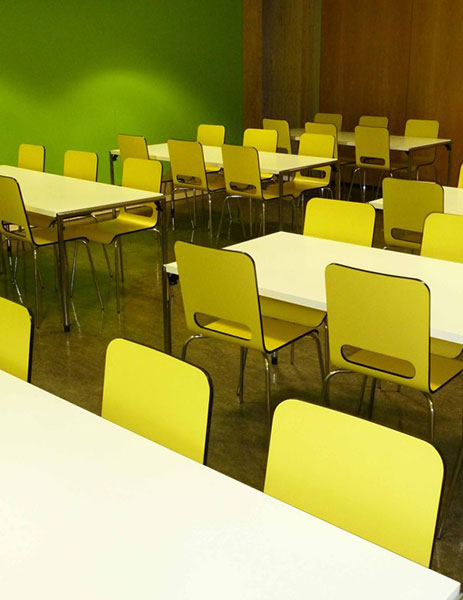
The width and height of the screenshot is (463, 600). What are the coordinates of `white rectangular table` in the screenshot? It's located at (401, 136), (454, 192), (310, 263), (281, 160), (57, 195), (73, 500).